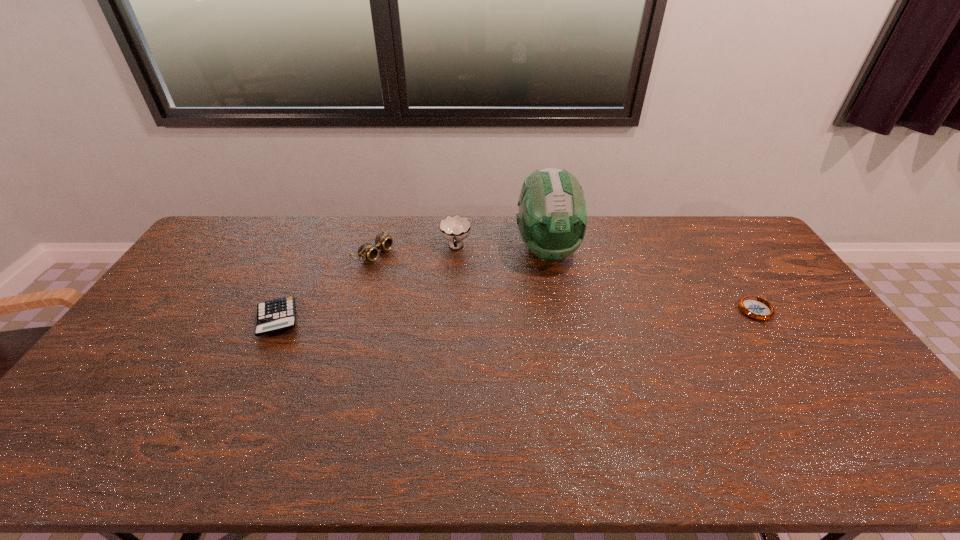
The image size is (960, 540). Identify the location of blank area located 0.310m on the left of the leftmost object. pos(151,320).

Identify the location of vacant point located 0.100m on the left of the shortest object. (708, 313).

Find the location of a particular element. free space located 0.050m on the visor of the fourth object from left to right is located at coordinates (556, 287).

Image resolution: width=960 pixels, height=540 pixels. I want to click on vacant space situated on the visor of the fourth object from left to right, so click(565, 322).

Find the location of `free space located 0.360m on the visor of the fourth object from left to right`. free space located 0.360m on the visor of the fourth object from left to right is located at coordinates (576, 362).

Where is `vacant space situated 0.310m through the lenses of the third tallest object`? The image size is (960, 540). vacant space situated 0.310m through the lenses of the third tallest object is located at coordinates (459, 294).

Find the location of a particular element. The width and height of the screenshot is (960, 540). vacant space located 0.070m through the lenses of the third tallest object is located at coordinates (403, 267).

Find the location of a particular element. Image resolution: width=960 pixels, height=540 pixels. vacant space positioned 0.250m through the lenses of the third tallest object is located at coordinates (444, 287).

Where is `vacant position located on the side of the fourth shortest object with the handle`? vacant position located on the side of the fourth shortest object with the handle is located at coordinates (456, 306).

Where is `vacant area situated 0.360m on the side of the fourth shortest object with the handle`? vacant area situated 0.360m on the side of the fourth shortest object with the handle is located at coordinates (456, 338).